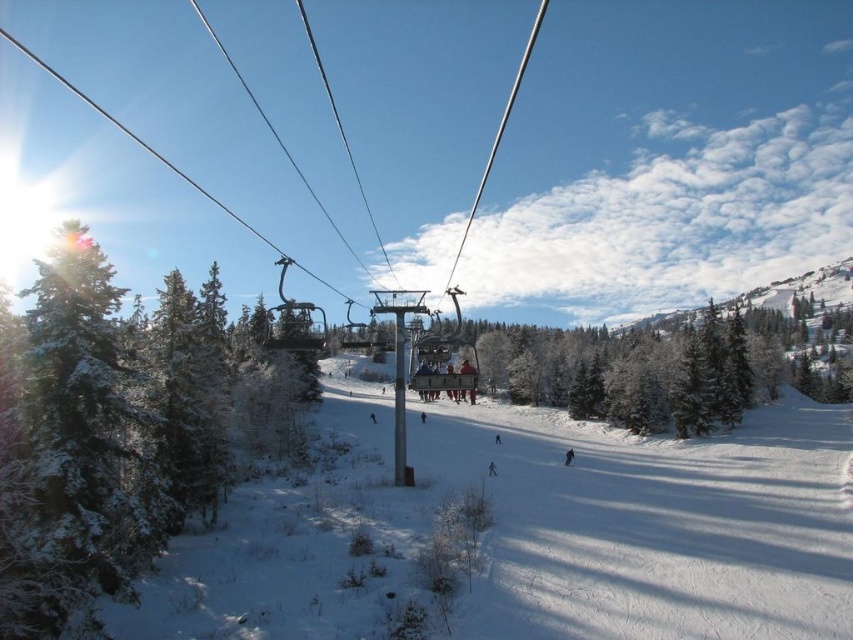
Question: Which object is farther from the camera taking this photo?

Choices:
 (A) snow-covered evergreen at left
 (B) white snowboarder at center

Answer: (B)

Question: Can you confirm if snow-covered evergreen at left is smaller than black snowboarder at lower center?

Choices:
 (A) yes
 (B) no

Answer: (B)

Question: Is black snowboarder at lower center closer to camera compared to white snowboarder at center?

Choices:
 (A) no
 (B) yes

Answer: (A)

Question: Which of these objects is positioned closest to the white snowboarder at center?

Choices:
 (A) black snowboarder at lower center
 (B) snow-covered evergreen at left

Answer: (A)

Question: Which point appears closest to the camera in this image?

Choices:
 (A) (196, 371)
 (B) (489, 468)

Answer: (A)

Question: Does snow-covered evergreen at left have a larger size compared to white snowboarder at center?

Choices:
 (A) no
 (B) yes

Answer: (B)